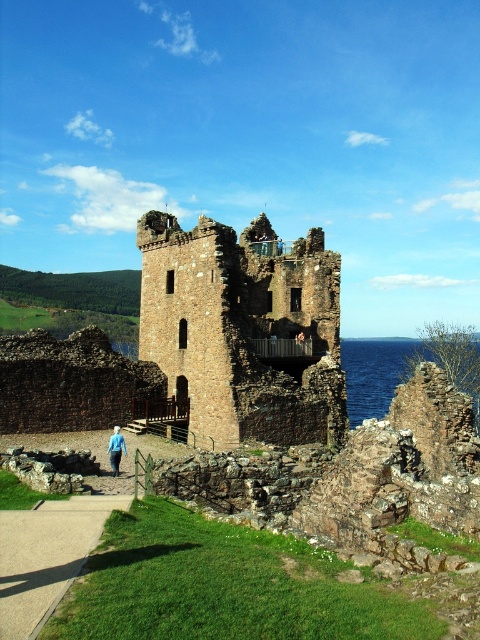
Question: Is gravel path at lower left positioned in front of blue denim jacket at lower left?

Choices:
 (A) no
 (B) yes

Answer: (B)

Question: Which point is farther to the camera?

Choices:
 (A) blue liquid water at right
 (B) gravel path at lower left
 (C) brown stone tower at center
 (D) blue denim jacket at lower left

Answer: (A)

Question: Is brown stone tower at center in front of blue denim jacket at lower left?

Choices:
 (A) no
 (B) yes

Answer: (A)

Question: Is brown stone tower at center thinner than gravel path at lower left?

Choices:
 (A) no
 (B) yes

Answer: (A)

Question: Which object appears farthest from the camera in this image?

Choices:
 (A) blue liquid water at right
 (B) brown stone tower at center

Answer: (A)

Question: Based on their relative distances, which object is farther from the gravel path at lower left?

Choices:
 (A) blue denim jacket at lower left
 (B) brown stone tower at center

Answer: (B)